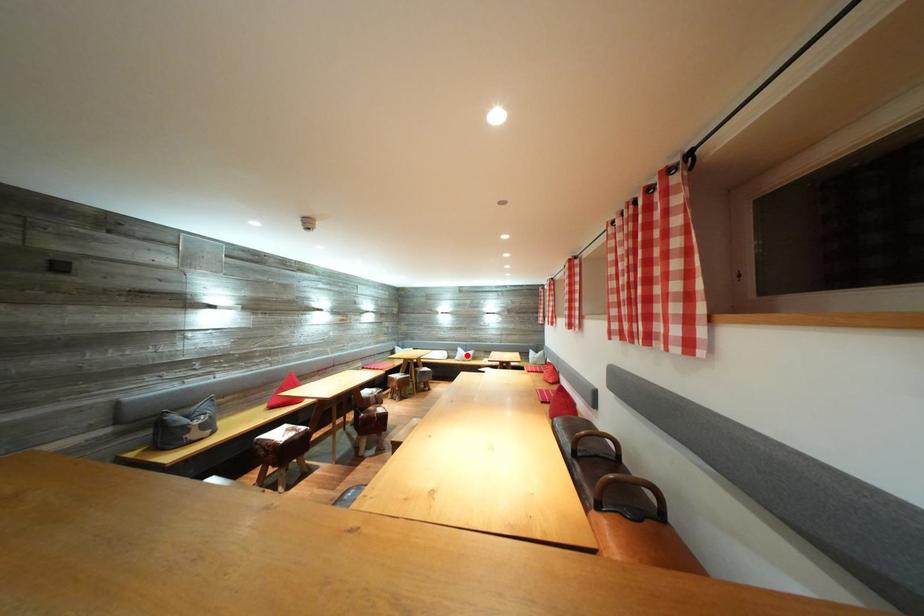
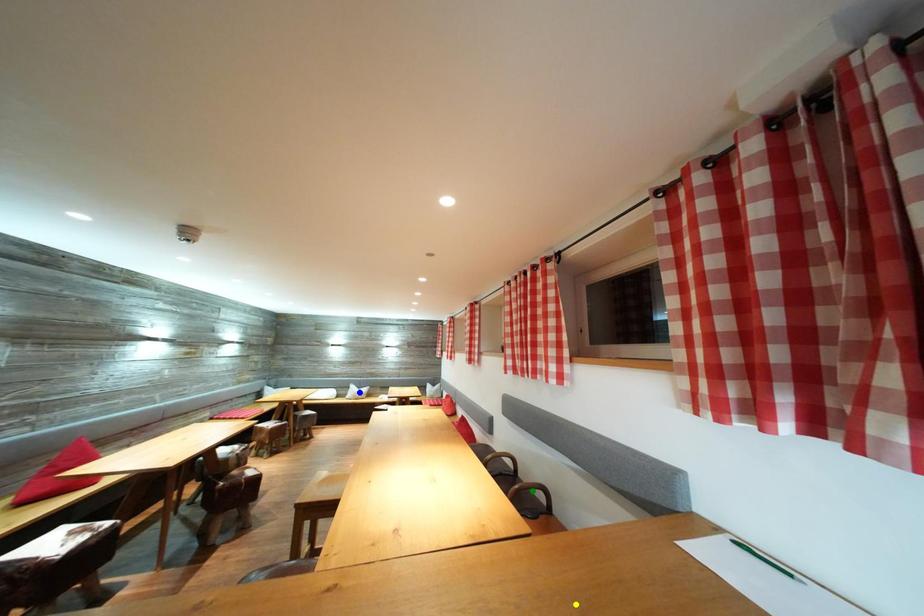
Question: I am providing you with two images of the same scene from different viewpoints. A red point is marked on the first image. You are given multiple points on the second image. Which point in image 2 is actually the same real-world point as the red point in image 1?

Choices:
 (A) green point
 (B) yellow point
 (C) blue point

Answer: (C)